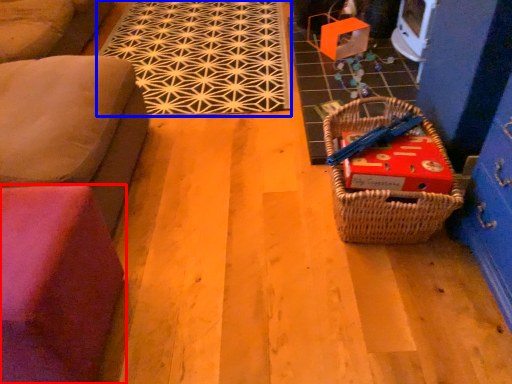
Question: Which point is closer to the camera, furniture (highlighted by a red box) or mat (highlighted by a blue box)?

Choices:
 (A) furniture
 (B) mat

Answer: (A)